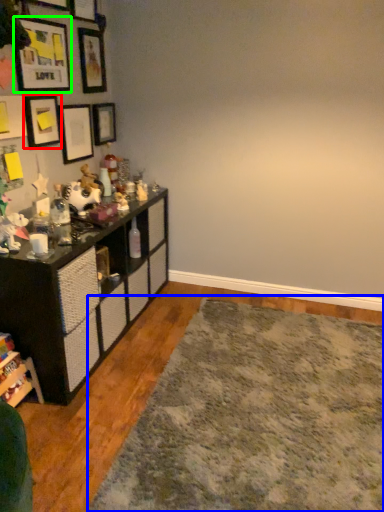
Question: Which object is positioned closest to picture frame (highlighted by a red box)? Select from mat (highlighted by a blue box) and picture frame (highlighted by a green box).

Choices:
 (A) mat
 (B) picture frame

Answer: (B)